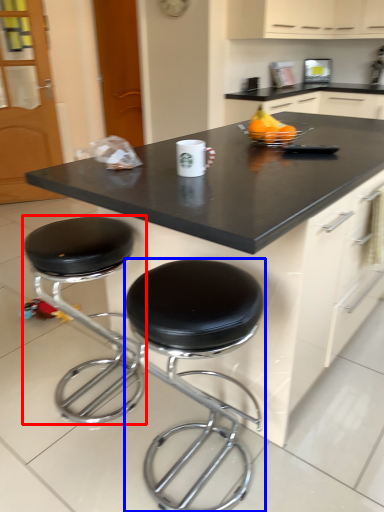
Question: Among these objects, which one is nearest to the camera, stool (highlighted by a red box) or stool (highlighted by a blue box)?

Choices:
 (A) stool
 (B) stool

Answer: (B)